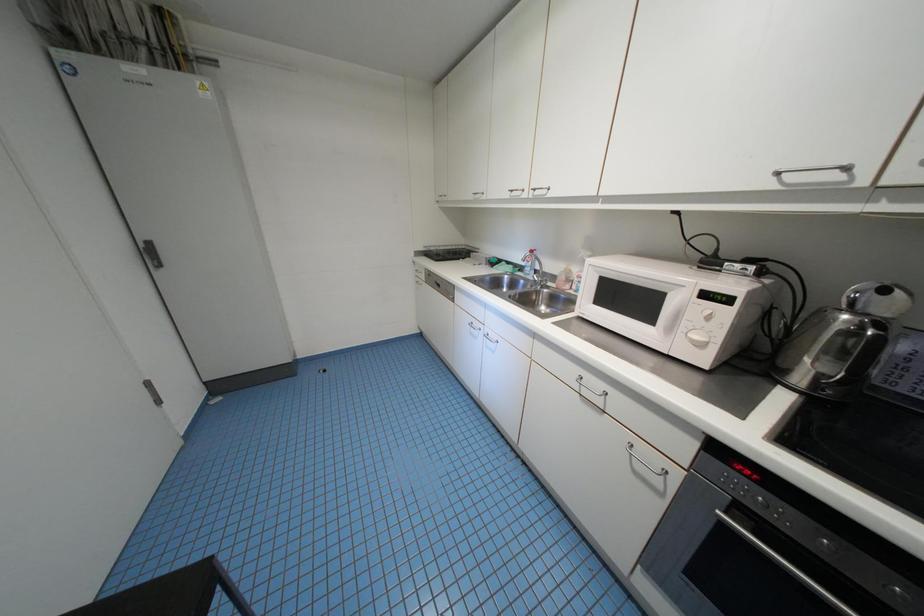
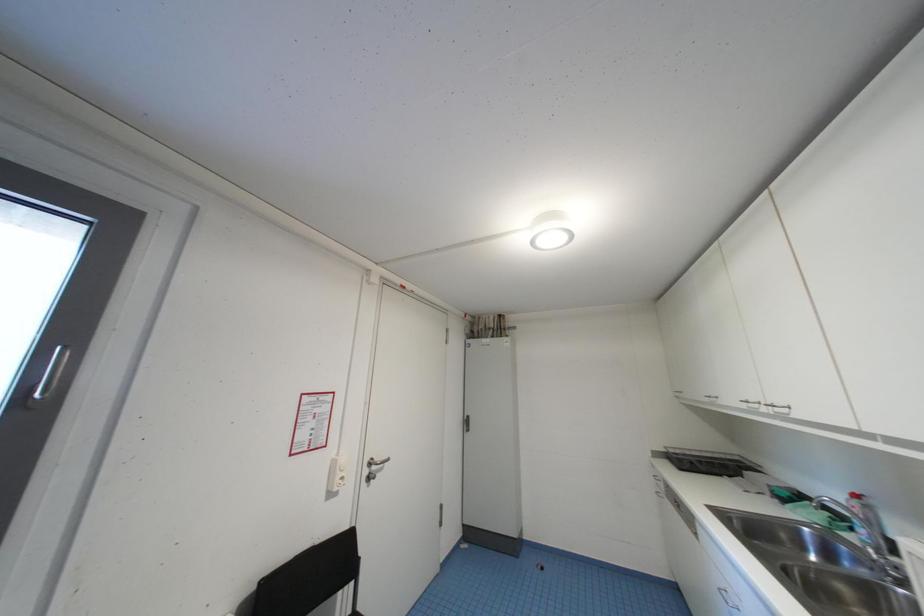
The images are taken continuously from a first-person perspective. In which direction is your viewpoint rotating?

The camera rotated toward left-up.